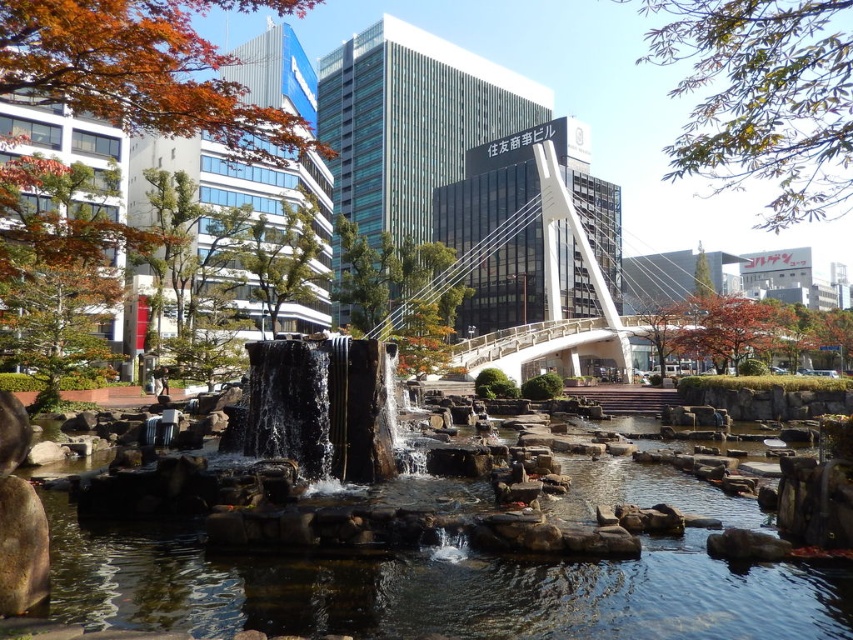
You are a park visitor wanting to cross the white glass bridge at center. However, you notice a small boat floating on the clear water at center. Can the boat pass under the bridge without touching it?

The clear water at center has a lesser width compared to white glass bridge at center, so the boat can pass under the bridge without touching it since the bridge is wider than the water body.

You are standing in the park and want to take a photo of the clear water at center. If your camera can focus on objects up to 15 meters away, will you need to move closer to capture a clear shot?

The clear water at center is 16.30 meters away from the viewer. Since your camera can focus up to 15 meters, you need to move closer to ensure the clear water at center is within the camera range.

You are standing in the park and want to take a photo of both the point at location (599,570) and the point at (489,344). Which point will appear larger in your camera view?

The point at location (599,570) will appear larger in your camera view because it is closer to the camera than the point at (489,344).